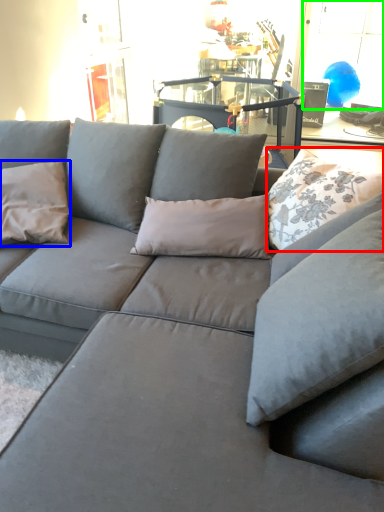
Question: Considering the real-world distances, which object is closest to pillow (highlighted by a red box)? pillow (highlighted by a blue box) or window (highlighted by a green box).

Choices:
 (A) pillow
 (B) window

Answer: (A)